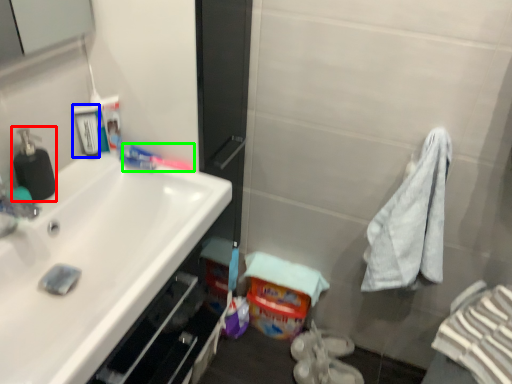
Question: Based on their relative distances, which object is farther from soap dispenser (highlighted by a red box)? Choose from mouthwash (highlighted by a blue box) and toothpaste (highlighted by a green box).

Choices:
 (A) mouthwash
 (B) toothpaste

Answer: (B)